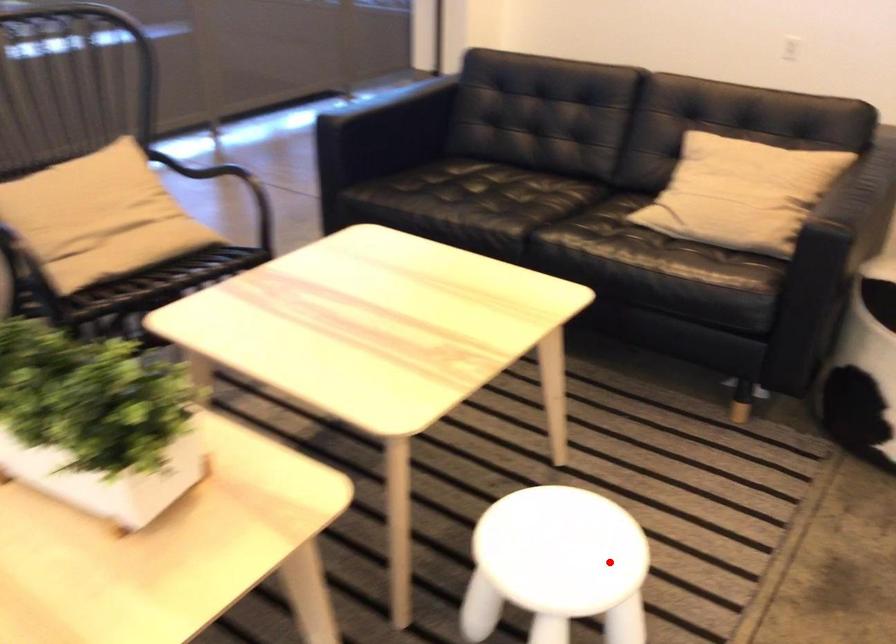
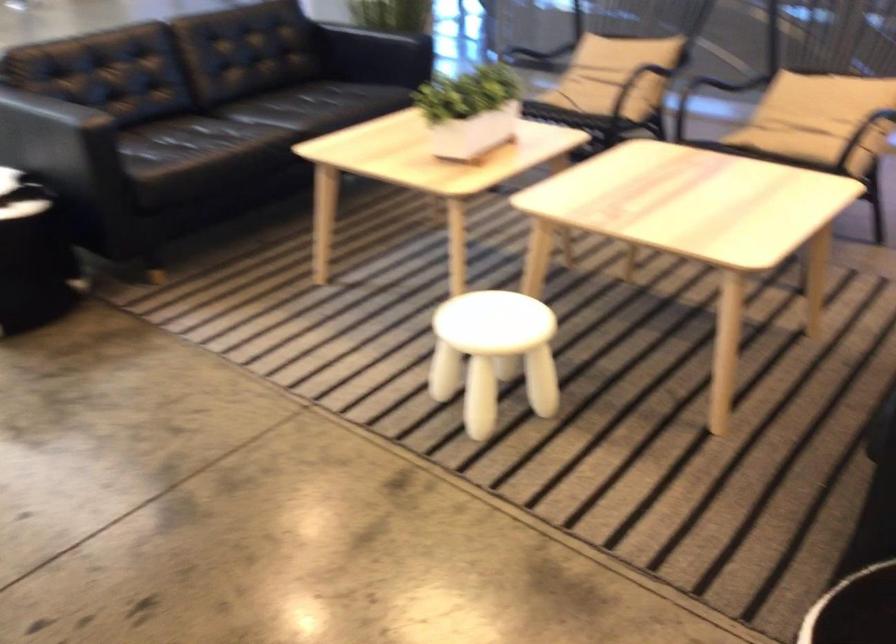
Where in the second image is the point corresponding to the highlighted location from the first image?

(493, 354)